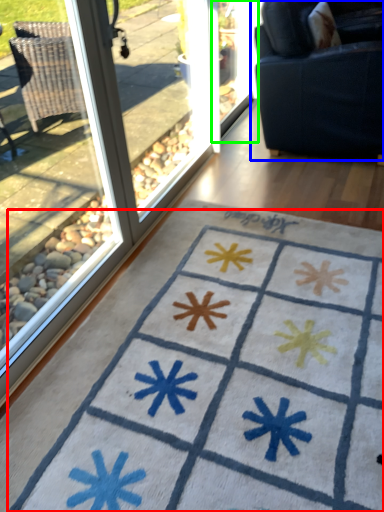
Question: Which is farther away from doormat (highlighted by a red box)? studio couch (highlighted by a blue box) or screen door (highlighted by a green box)?

Choices:
 (A) studio couch
 (B) screen door

Answer: (B)